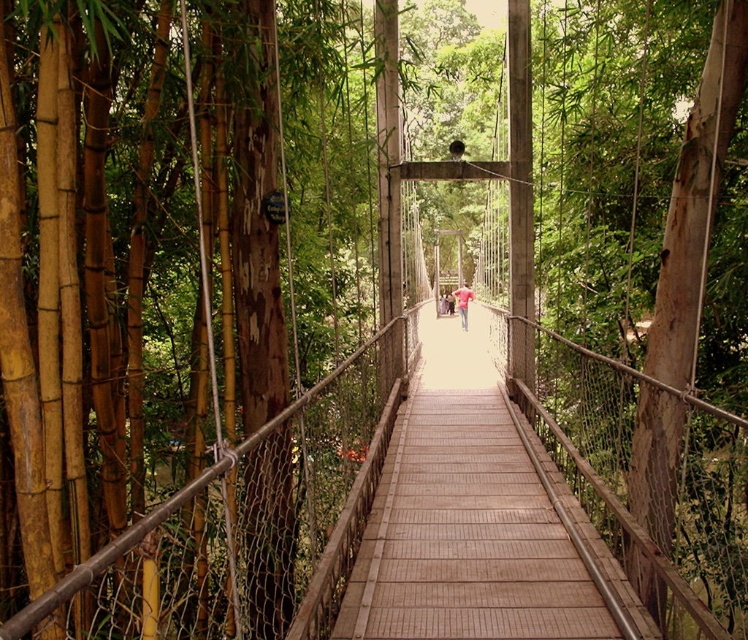
You are a hiker standing on the wooden bridge at center. You notice a pink fabric shirt at center nearby. Which object occupies more space in the image?

The pink fabric shirt at center occupies more space in the image because the wooden bridge at center has a smaller size compared to it.